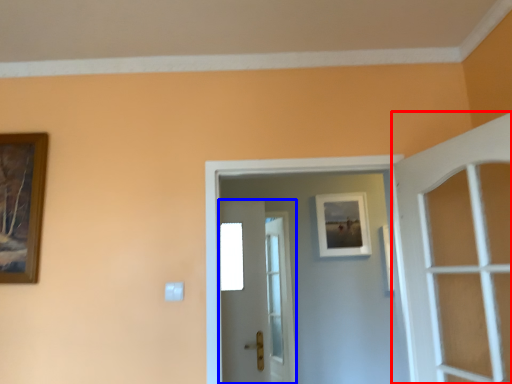
Question: Which point is further to the camera, door (highlighted by a red box) or door (highlighted by a blue box)?

Choices:
 (A) door
 (B) door

Answer: (B)